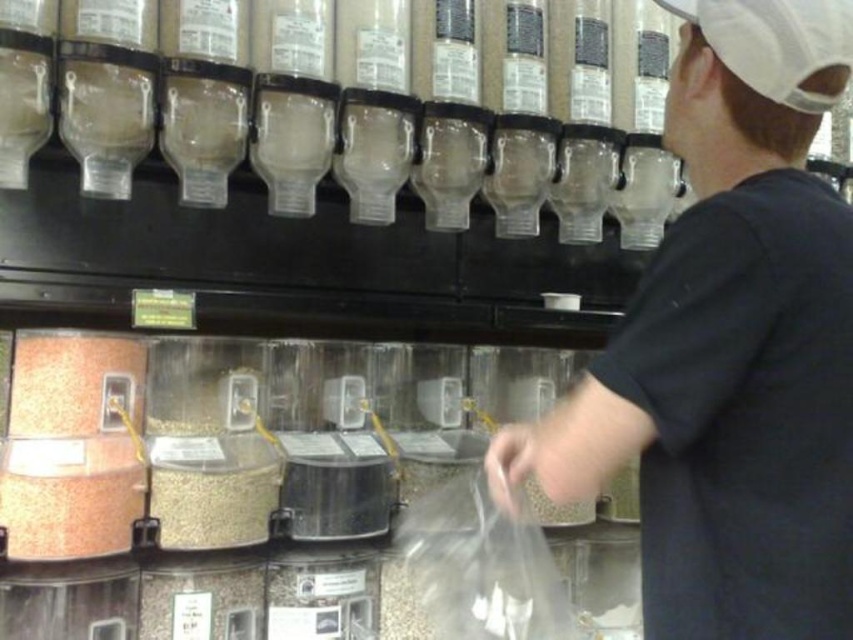
You are a customer trying to choose between two items in the store. You need to know which one is wider. Which item has a smaller width, the matte orange powder at lower left or the gray matte grain at center?

The matte orange powder at lower left has a lesser width compared to gray matte grain at center, so the matte orange powder at lower left is the one with the smaller width.

What is the object at point [730,348] in the image?

The point [730,348] is on the black matte shirt at center.

You are a customer in the store and want to take some matte orange powder at lower left and gray matte grain at center. Which one should you reach for first if you want to get the one that is higher up?

The matte orange powder at lower left is positioned over the gray matte grain at center, so you should reach for the matte orange powder at lower left first as it is higher up.